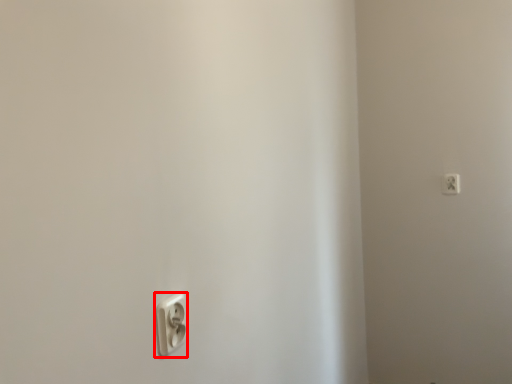
Question: Considering the relative positions of power plugs and sockets (annotated by the red box) and power plugs and sockets in the image provided, where is power plugs and sockets (annotated by the red box) located with respect to the staircase?

Choices:
 (A) right
 (B) left

Answer: (B)